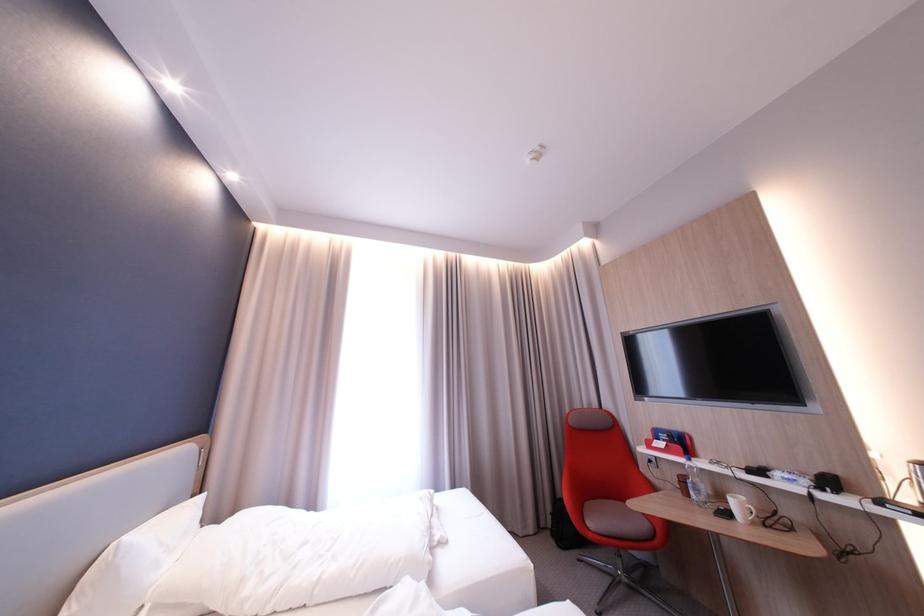
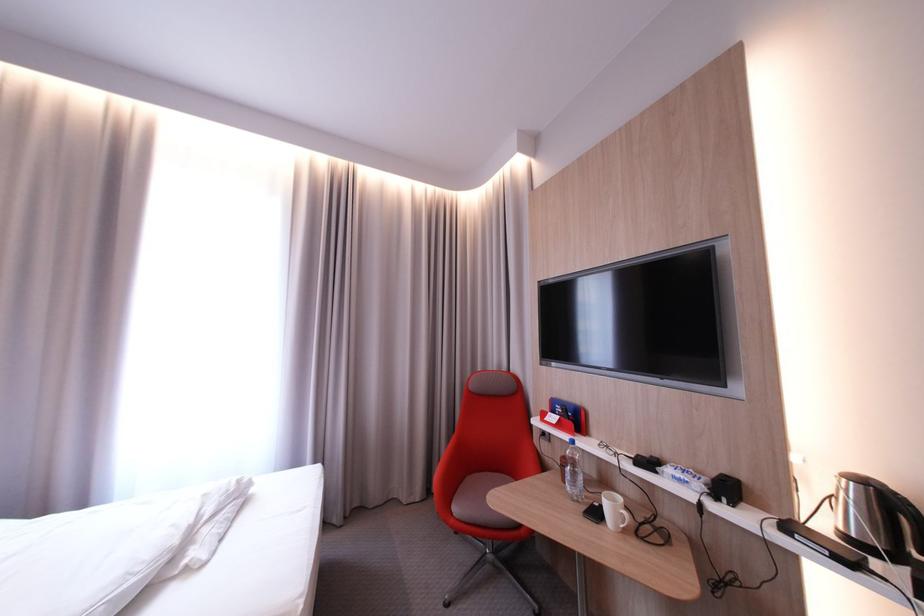
Find the pixel in the second image that matches the point at 698,495 in the first image.

(576, 482)